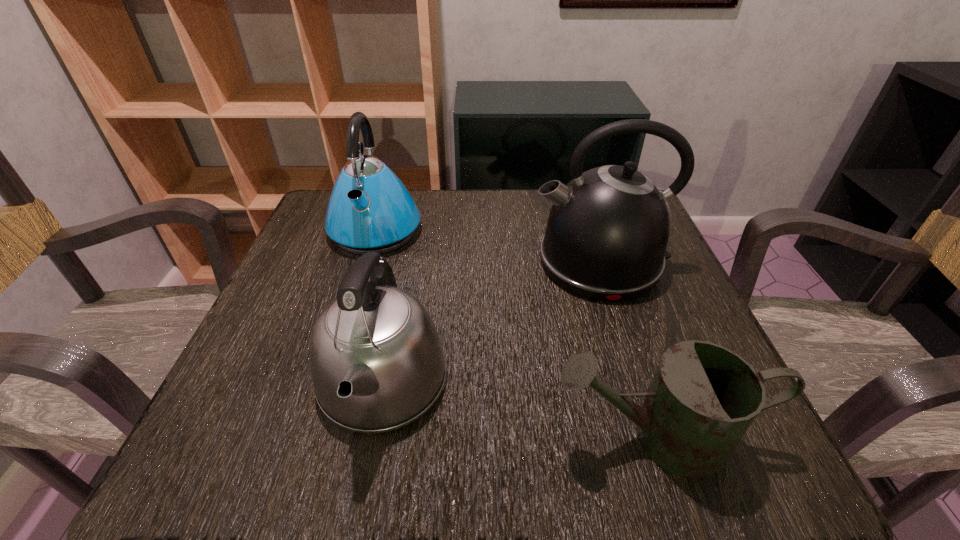
This screenshot has height=540, width=960. Identify the location of the rightmost kettle. (607, 232).

This screenshot has height=540, width=960. I want to click on the nearest kettle, so click(376, 359).

Locate an element on the screen. The width and height of the screenshot is (960, 540). the shortest object is located at coordinates pyautogui.click(x=703, y=397).

Locate an element on the screen. The width and height of the screenshot is (960, 540). vacant space situated 0.160m on the spout of the rightmost kettle is located at coordinates (456, 261).

At what (x,y) coordinates should I click in order to perform the action: click on free location located on the spout of the rightmost kettle. Please return your answer as a coordinate pair (x, y). The width and height of the screenshot is (960, 540). Looking at the image, I should click on (422, 261).

Find the location of a particular element. This screenshot has height=540, width=960. vacant space situated on the spout of the rightmost kettle is located at coordinates (498, 261).

At what (x,y) coordinates should I click in order to perform the action: click on free space located 0.400m with the spout on the shortest object. Please return your answer as a coordinate pair (x, y). The image size is (960, 540). Looking at the image, I should click on (271, 437).

Identify the location of blank area located 0.220m with the spout on the shortest object. This screenshot has width=960, height=540. (396, 437).

Identify the location of vacant area located 0.130m with the spout on the shortest object. (459, 437).

This screenshot has height=540, width=960. Find the location of `kettle that is at the near edge`. kettle that is at the near edge is located at coordinates (376, 359).